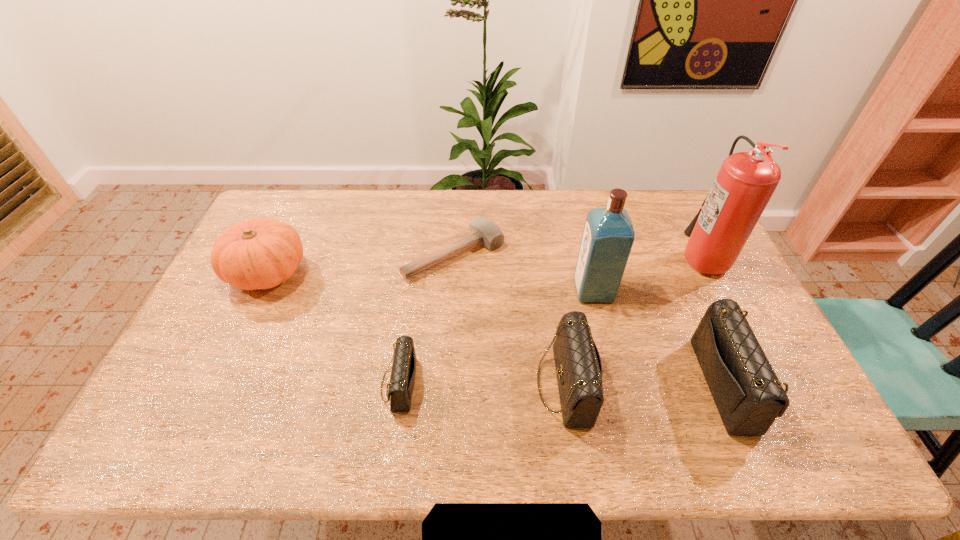
This screenshot has height=540, width=960. What are the coordinates of `empty location between the fifth object from left to right and the pumpkin` in the screenshot? It's located at [x=431, y=281].

You are a GUI agent. You are given a task and a screenshot of the screen. Output one action in this format:
    pyautogui.click(x=<x>, y=<y>)
    Task: Click on the vacant area that lies between the second tallest clutch bag and the leftmost object
    Image resolution: width=960 pixels, height=540 pixels.
    Given the screenshot: What is the action you would take?
    pyautogui.click(x=417, y=328)

The image size is (960, 540). In order to click on vacant region between the rightmost clutch bag and the liquor in this screenshot , I will do `click(661, 338)`.

The width and height of the screenshot is (960, 540). Identify the location of object identified as the fifth closest to the mallet. (749, 397).

I want to click on the third closest object to the mallet, so click(402, 378).

Where is `clutch bag that is the second closest to the second shortest clutch bag`? The width and height of the screenshot is (960, 540). clutch bag that is the second closest to the second shortest clutch bag is located at coordinates (402, 378).

Point out which clutch bag is positioned as the third nearest to the pumpkin. Please provide its 2D coordinates. Your answer should be formatted as a tuple, i.e. [(x, y)], where the tuple contains the x and y coordinates of a point satisfying the conditions above.

[(749, 397)]

Identify the location of vacant space that satisfies the following two spatial constraints: 1. on the instruction side of the tallest object; 2. on the front side of the pumpkin. The image size is (960, 540). (710, 272).

Where is `free space that satisfies the following two spatial constraints: 1. on the front side of the mallet; 2. on the front flap of the second shortest object`? The height and width of the screenshot is (540, 960). free space that satisfies the following two spatial constraints: 1. on the front side of the mallet; 2. on the front flap of the second shortest object is located at coordinates (446, 384).